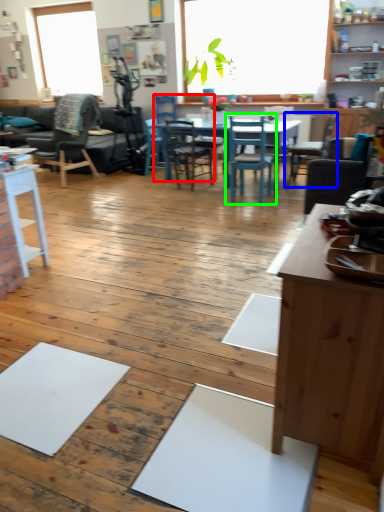
Question: Based on their relative distances, which object is nearer to chair (highlighted by a red box)? Choose from chair (highlighted by a blue box) and chair (highlighted by a green box).

Choices:
 (A) chair
 (B) chair

Answer: (B)